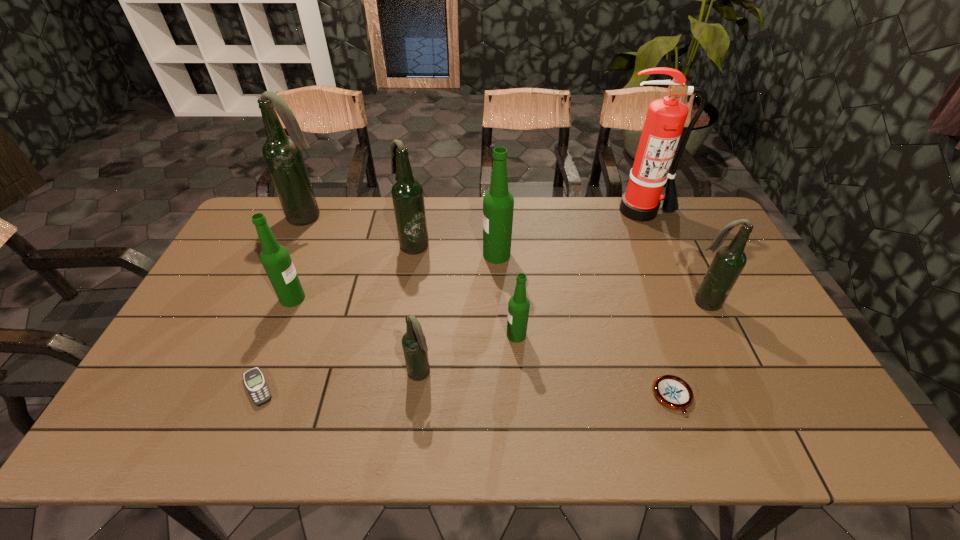
Locate an element on the screen. This screenshot has width=960, height=540. the second nearest beer bottle is located at coordinates (518, 307).

In order to click on the smallest dark beer bottle in this screenshot , I will do `click(415, 350)`.

Image resolution: width=960 pixels, height=540 pixels. I want to click on the nearest beer bottle, so click(x=415, y=350).

This screenshot has height=540, width=960. Find the location of `compass`. compass is located at coordinates click(673, 392).

Locate an element on the screen. The height and width of the screenshot is (540, 960). gray beeper is located at coordinates (255, 382).

At what (x,y) coordinates should I click in order to perform the action: click on beeper. Please return your answer as a coordinate pair (x, y). This screenshot has width=960, height=540. Looking at the image, I should click on (255, 382).

In order to click on free region located at the nozzle of the red fire extinguisher in this screenshot , I will do `click(670, 278)`.

Locate an element on the screen. free space located 0.060m on the front of the tallest beer bottle is located at coordinates (300, 238).

This screenshot has height=540, width=960. I want to click on vacant space situated 0.190m on the label of the farthest green beer bottle, so tap(424, 255).

Locate an element on the screen. The height and width of the screenshot is (540, 960). free space located 0.310m on the label of the farthest green beer bottle is located at coordinates (387, 255).